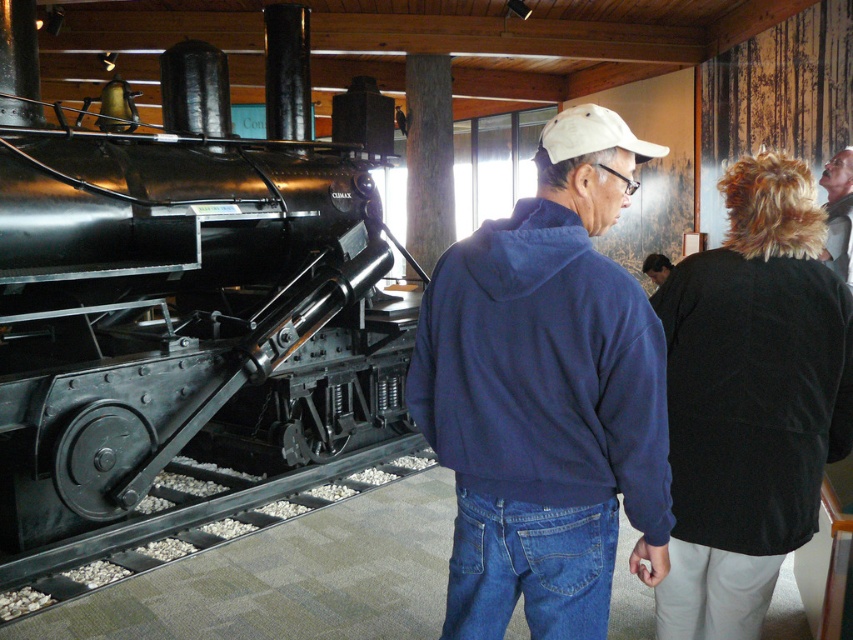
Question: Does polished black locomotive at left appear under black metal train track at lower left?

Choices:
 (A) no
 (B) yes

Answer: (A)

Question: Among these objects, which one is farthest from the camera?

Choices:
 (A) blue fleece jacket at center
 (B) white fabric baseball cap at upper center
 (C) smooth blonde hair at upper right
 (D) black metal train track at lower left

Answer: (C)

Question: Which object is the farthest from the white fabric baseball cap at upper center?

Choices:
 (A) black metal train track at lower left
 (B) smooth blonde hair at upper right

Answer: (A)

Question: Is polished black locomotive at left in front of blue fleece jacket at center?

Choices:
 (A) no
 (B) yes

Answer: (A)

Question: Does white fabric baseball cap at upper center have a lesser width compared to smooth blonde hair at upper right?

Choices:
 (A) no
 (B) yes

Answer: (B)

Question: Which point is farther to the camera?

Choices:
 (A) polished black locomotive at left
 (B) white fabric baseball cap at upper center
 (C) black metal train track at lower left

Answer: (A)